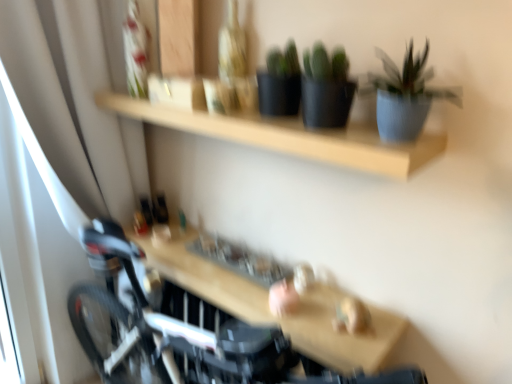
Where is `free space above wooden shelf at center (from a real-world perspective)`? free space above wooden shelf at center (from a real-world perspective) is located at coordinates click(249, 288).